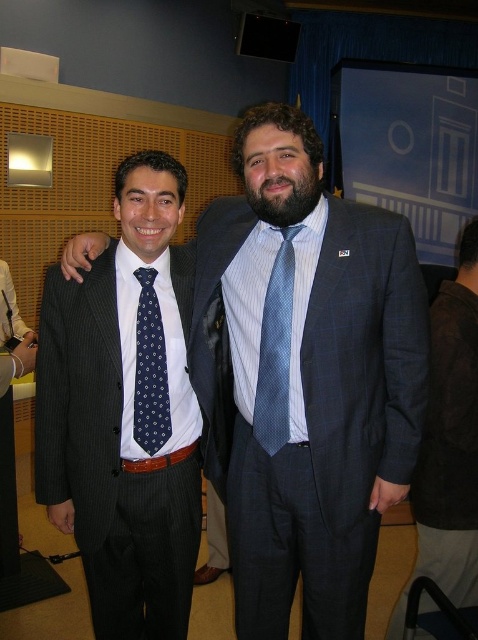
Looking at this image, which of these two, blue dotted tie at center or navy dotted tie at center, stands taller?

blue dotted tie at center is taller.

Which is in front, point (293, 252) or point (152, 385)?

Point (293, 252) is more forward.

You are a GUI agent. You are given a task and a screenshot of the screen. Output one action in this format:
    pyautogui.click(x=<x>, y=<y>)
    Task: Click on the blue dotted tie at center
    
    Given the screenshot: What is the action you would take?
    pyautogui.click(x=275, y=349)

Does pinstriped suit at left have a lesser height compared to blue dotted tie at center?

Incorrect, pinstriped suit at left's height does not fall short of blue dotted tie at center's.

Which is in front, point (63, 371) or point (269, 410)?

Point (269, 410) is in front.

What are the coordinates of `pinstriped suit at left` in the screenshot? It's located at (126, 412).

Who is more distant from viewer, (295,544) or (290,250)?

Point (295,544)

Does point (297, 554) lie in front of point (280, 282)?

That is False.

Where is `blue textured suit at center`? Image resolution: width=478 pixels, height=640 pixels. blue textured suit at center is located at coordinates (304, 378).